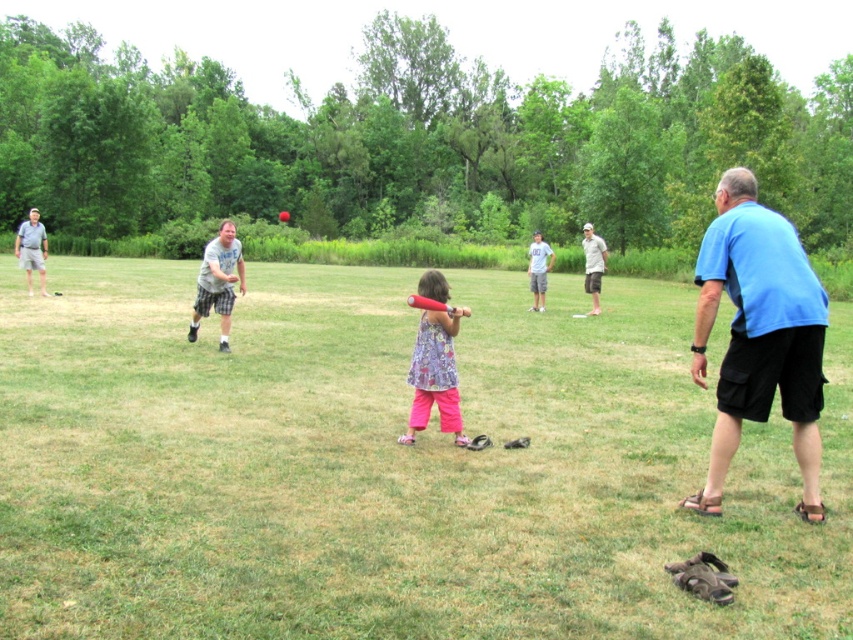
Question: Considering the relative positions of light blue t-shirt at center and rubberized pink bat at center in the image provided, where is light blue t-shirt at center located with respect to rubberized pink bat at center?

Choices:
 (A) left
 (B) right

Answer: (B)

Question: In this image, where is floral fabric dress at center located relative to gray cotton shirt at left?

Choices:
 (A) above
 (B) below

Answer: (B)

Question: Among these objects, which one is farthest from the camera?

Choices:
 (A) floral fabric dress at center
 (B) blue t-shirt at right

Answer: (A)

Question: Based on their relative distances, which object is farther from the rubberized pink bat at center?

Choices:
 (A) gray cotton shirt at left
 (B) light gray cotton shirt at right

Answer: (A)

Question: Which of the following is the farthest from the observer?

Choices:
 (A) (460, 436)
 (B) (33, 209)
 (C) (593, 307)
 (D) (543, 305)

Answer: (B)

Question: Where is green grass at center located in relation to matte gray shorts at left in the image?

Choices:
 (A) below
 (B) above

Answer: (A)